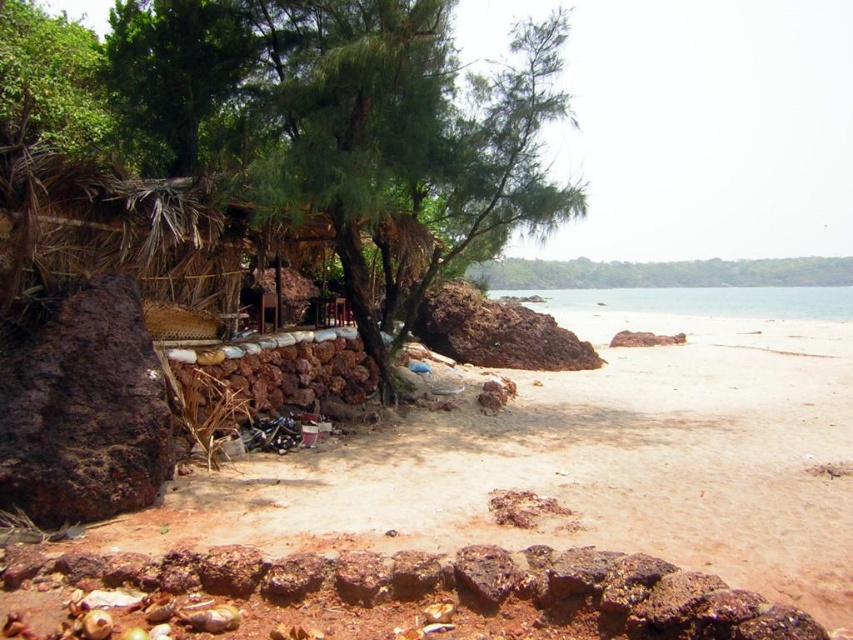
Question: Is brown rock at left bigger than clear water at right?

Choices:
 (A) yes
 (B) no

Answer: (B)

Question: Which point is closer to the camera?

Choices:
 (A) brown rock at left
 (B) green leafy tree at left

Answer: (A)

Question: Does green leafy tree at left appear on the left side of rusty stone wall at lower left?

Choices:
 (A) no
 (B) yes

Answer: (B)

Question: Which of these objects is positioned closest to the green leafy tree at left?

Choices:
 (A) clear water at right
 (B) rusty stone wall at lower left
 (C) brown rock at left

Answer: (C)

Question: Can you confirm if brown rock at left is positioned to the right of rusty stone wall at lower left?

Choices:
 (A) no
 (B) yes

Answer: (B)

Question: Based on their relative distances, which object is farther from the clear water at right?

Choices:
 (A) green leafy tree at left
 (B) rusty stone wall at lower left

Answer: (B)